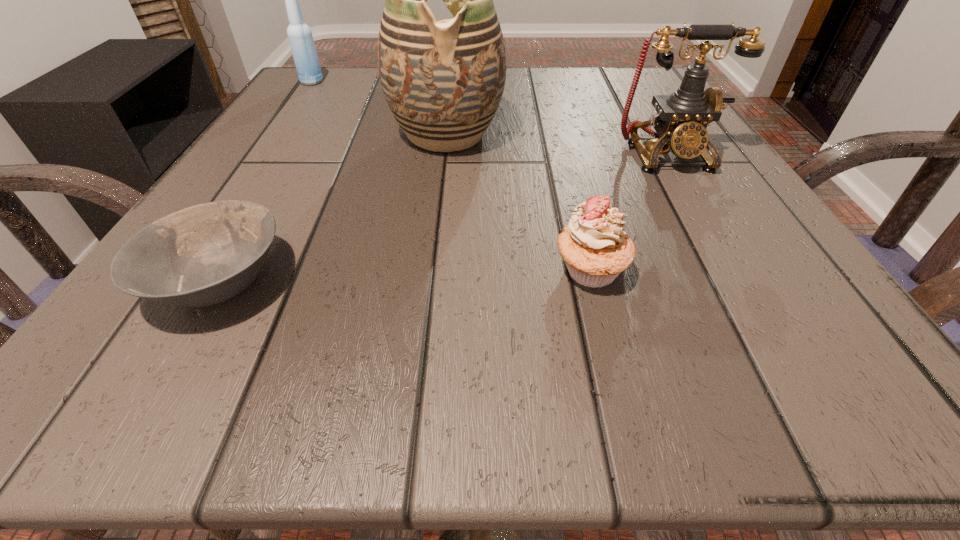
Find the location of `free space between the shortest object and the farthest object`. free space between the shortest object and the farthest object is located at coordinates (266, 181).

You are a GUI agent. You are given a task and a screenshot of the screen. Output one action in this format:
    pyautogui.click(x=<x>, y=<y>)
    Task: Click on the free spot between the cupcake and the third object from left to right
    Image resolution: width=960 pixels, height=540 pixels.
    Given the screenshot: What is the action you would take?
    pyautogui.click(x=518, y=202)

What are the coordinates of `free spot between the pottery and the shortest object` in the screenshot? It's located at (333, 207).

Locate an element on the screen. free space that is in between the second shortest object and the bowl is located at coordinates (405, 275).

Locate which object is the second closest to the third object from right to left. Please provide its 2D coordinates. Your answer should be formatted as a tuple, i.e. [(x, y)], where the tuple contains the x and y coordinates of a point satisfying the conditions above.

[(202, 255)]

Select which object appears as the second closest to the telephone. Please provide its 2D coordinates. Your answer should be formatted as a tuple, i.e. [(x, y)], where the tuple contains the x and y coordinates of a point satisfying the conditions above.

[(443, 81)]

At what (x,y) coordinates should I click in order to perform the action: click on free location that satisfies the following two spatial constraints: 1. on the back side of the third object from right to left; 2. on the right side of the bowl. Please return your answer as a coordinate pair (x, y). The height and width of the screenshot is (540, 960). Looking at the image, I should click on (304, 135).